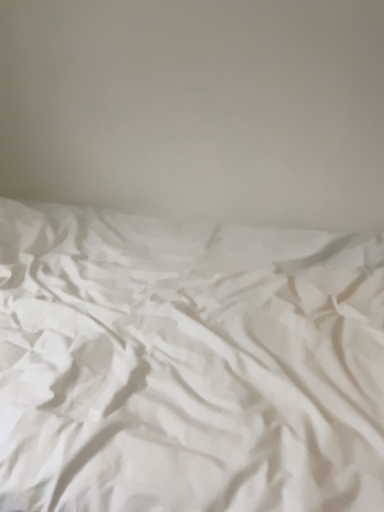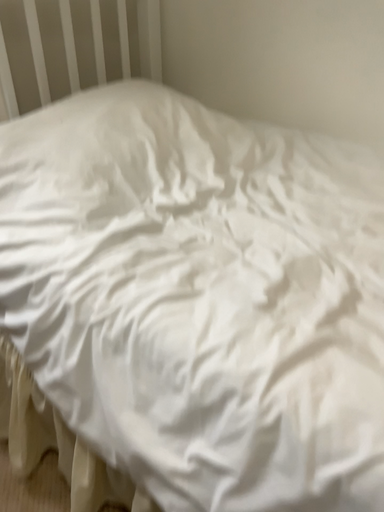
Question: Which way did the camera rotate in the video?

Choices:
 (A) rotated right
 (B) rotated left

Answer: (B)